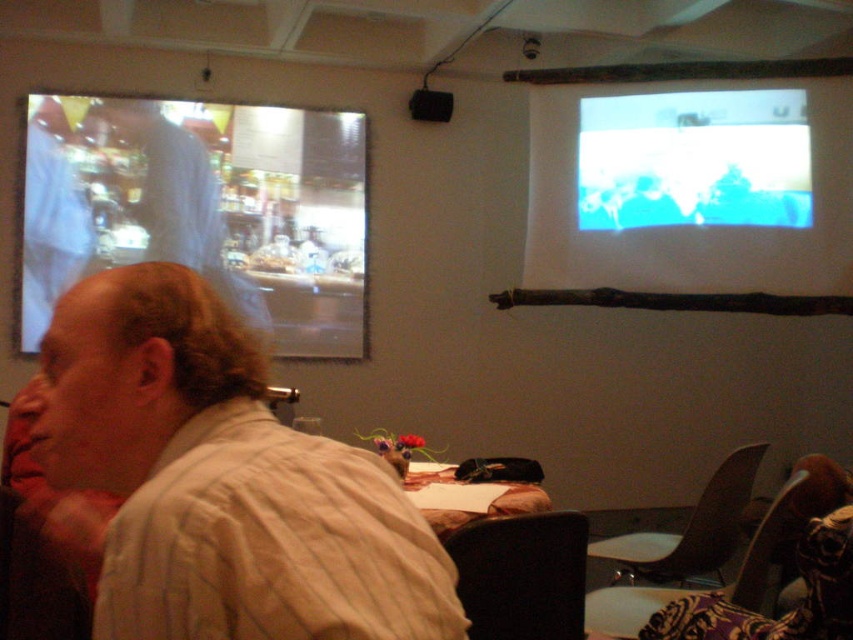
You are a photographer who needs to capture the white striped shirt at left and the wooden table at center in a single frame. Based on their positions, which object should you focus on first to ensure both are in focus?

The white striped shirt at left is located above the wooden table at center, so you should focus on the wooden table at center first since it is closer to the camera. This will ensure the shirt at left is also in focus due to its position above.

You are an interior designer assessing the placement of the matte glass display at upper left and the blue matte screen at upper right. Based on their positions, which object is positioned lower in the image?

The matte glass display at upper left is located below the blue matte screen at upper right, so it is positioned lower in the image.